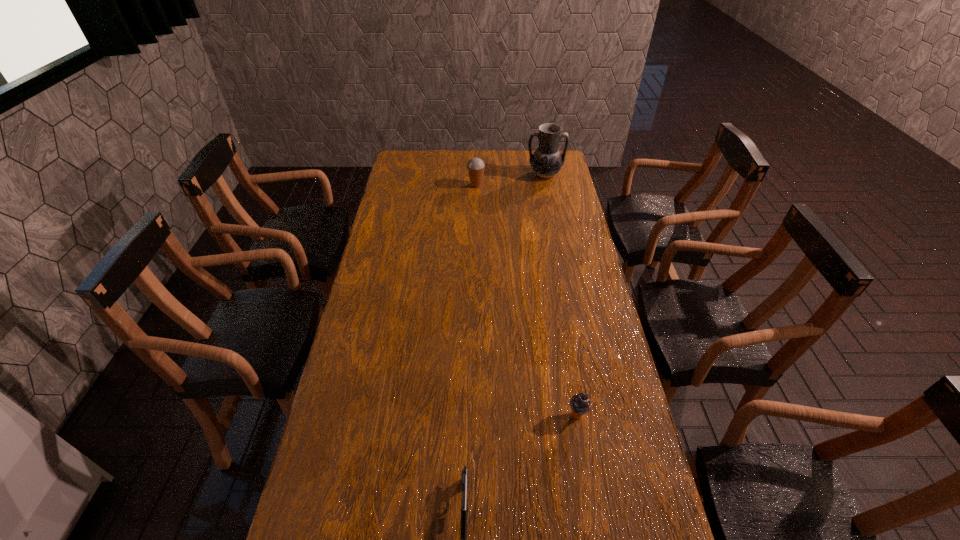
This screenshot has width=960, height=540. Identify the location of free spot between the taller icecream and the third tallest object. (527, 301).

Identify which object is the closest to the farther icecream. Please provide its 2D coordinates. Your answer should be formatted as a tuple, i.e. [(x, y)], where the tuple contains the x and y coordinates of a point satisfying the conditions above.

[(546, 162)]

Identify which object is the third nearest to the farther icecream. Please provide its 2D coordinates. Your answer should be formatted as a tuple, i.e. [(x, y)], where the tuple contains the x and y coordinates of a point satisfying the conditions above.

[(464, 510)]

The height and width of the screenshot is (540, 960). In order to click on vacant space that satisfies the following two spatial constraints: 1. on the front side of the nearer icecream; 2. on the left side of the third shortest object in this screenshot , I will do `click(473, 416)`.